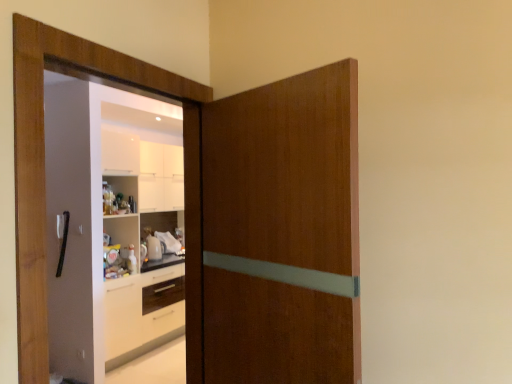
You are a GUI agent. You are given a task and a screenshot of the screen. Output one action in this format:
    pyautogui.click(x=<x>, y=<y>)
    Task: Click on the empty space that is ontop of wooden screen door at left (from a real-world perspective)
    
    Given the screenshot: What is the action you would take?
    tap(136, 54)